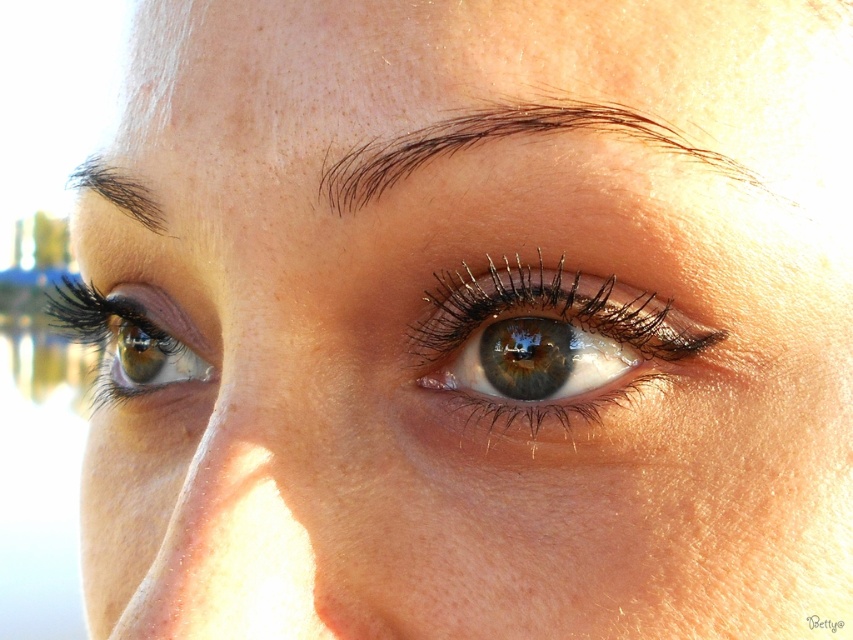
Looking at the closeup portrait of the person, where is the brown matte eye at center in relation to the matte brown eye at lower left?

The brown matte eye at center is positioned to the right of the matte brown eye at lower left.

Looking at the portrait, which eye is positioned lower between the brown matte eye at center and the matte brown eye at lower left?

The brown matte eye at center is positioned lower than the matte brown eye at lower left.

You are a photographer analyzing the portrait. The brown matte eye at center and the dark brown hair at upper left are both visible in the frame. Which of these two elements occupies a greater vertical space in the image?

The brown matte eye at center is taller than the dark brown hair at upper left, meaning it occupies more vertical space in the image.